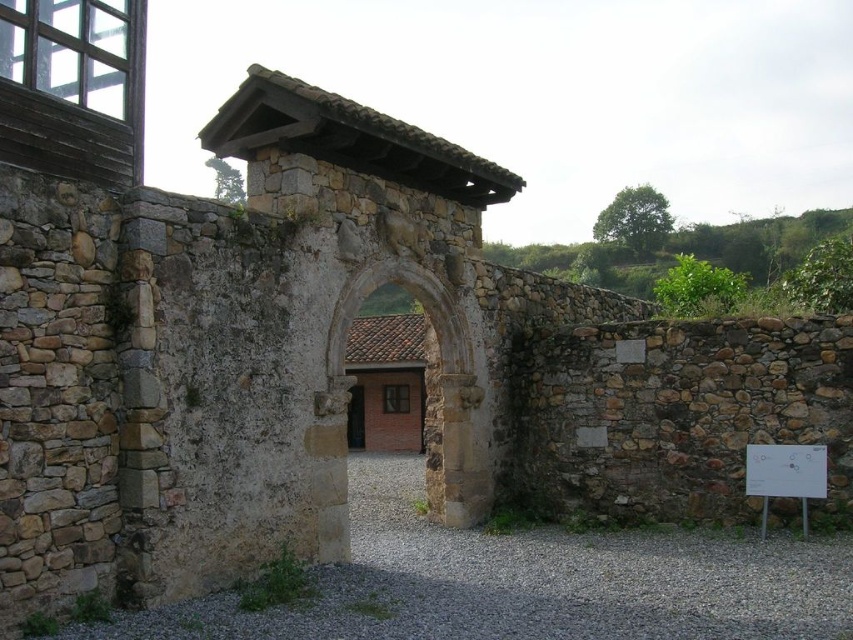
Question: Is stone textured archway at center thinner than white paper at lower right?

Choices:
 (A) yes
 (B) no

Answer: (B)

Question: Can you confirm if stone textured archway at center is thinner than white paper at lower right?

Choices:
 (A) no
 (B) yes

Answer: (A)

Question: Which point appears closest to the camera in this image?

Choices:
 (A) (793, 452)
 (B) (466, 349)

Answer: (A)

Question: Does stone textured archway at center have a greater width compared to white paper at lower right?

Choices:
 (A) no
 (B) yes

Answer: (B)

Question: Which of the following is the farthest from the observer?

Choices:
 (A) stone textured archway at center
 (B) white paper at lower right

Answer: (B)

Question: Which object appears farthest from the camera in this image?

Choices:
 (A) white paper at lower right
 (B) stone textured archway at center

Answer: (A)